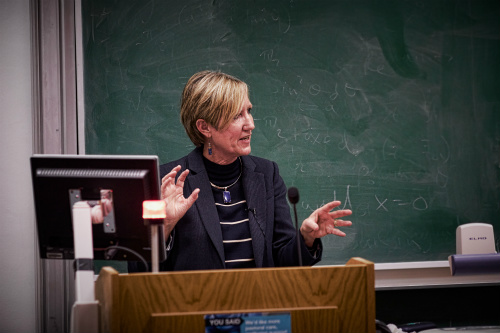
Find the location of a particular element. Image resolution: width=500 pixels, height=333 pixels. front of wooden podium is located at coordinates (150, 294), (292, 285).